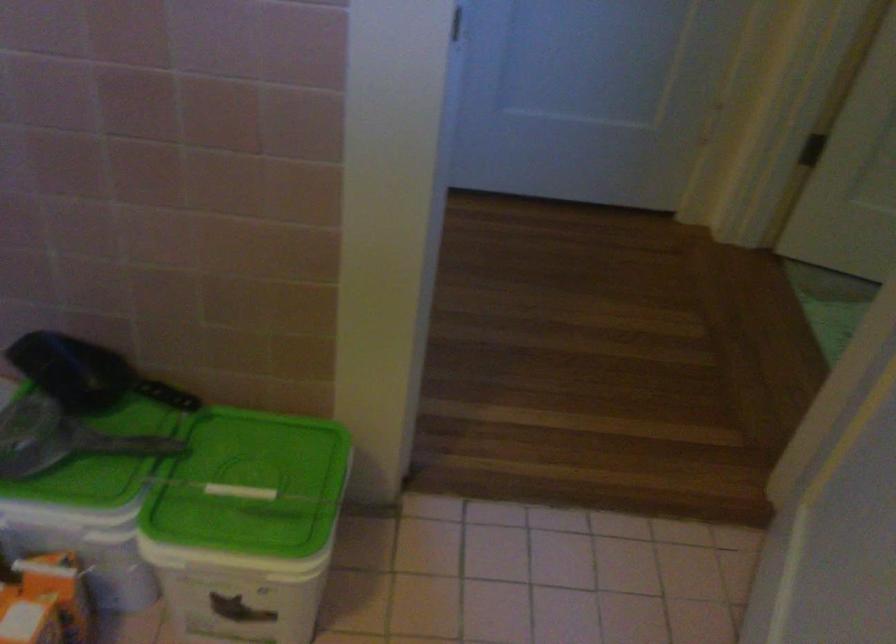
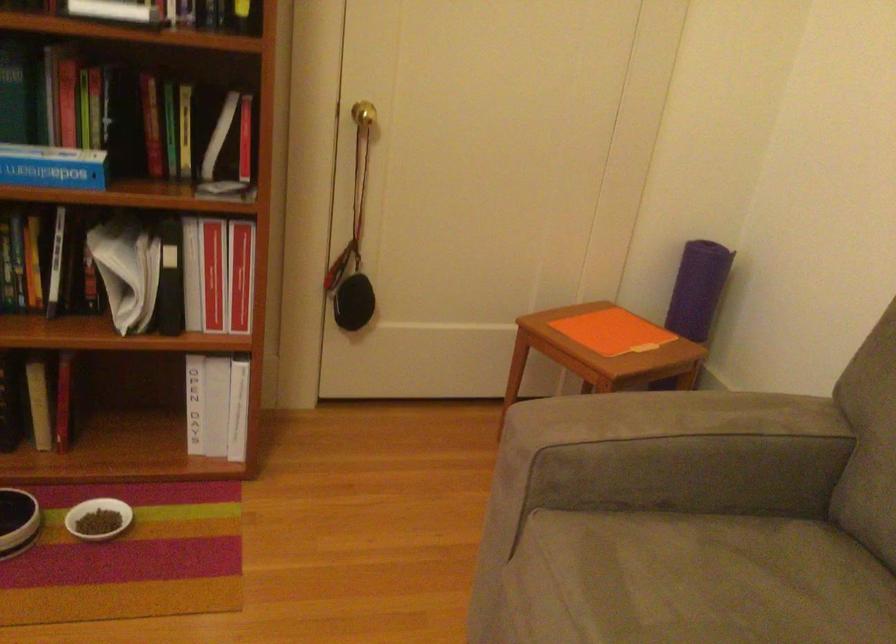
Question: I am providing you with two images of the same scene from different viewpoints. Please identify which objects are invisible in image2.

Choices:
 (A) grey scoop handle
 (B) tissue box
 (C) sofa sitting surface
 (D) white pet bowl

Answer: (A)